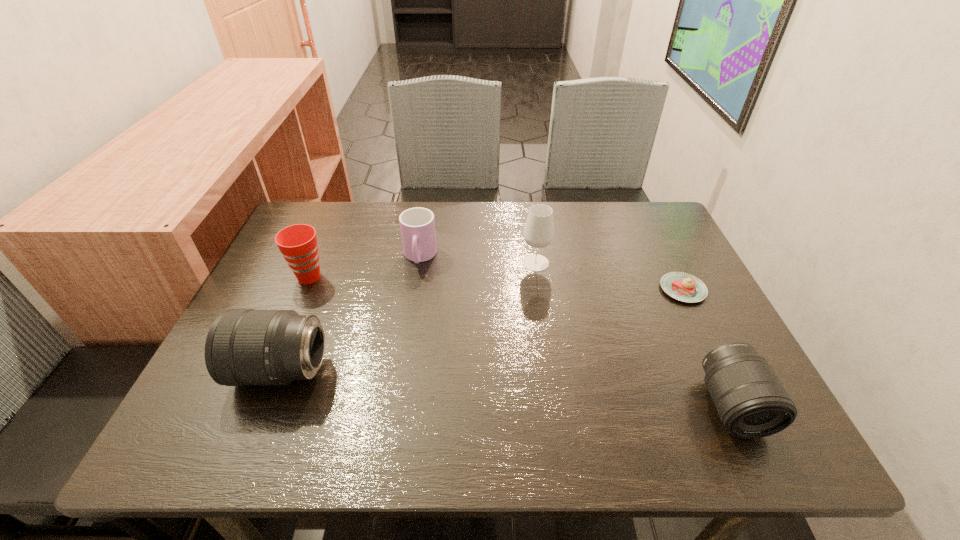
Where is `vacant space at the right edge of the desktop`? This screenshot has width=960, height=540. vacant space at the right edge of the desktop is located at coordinates (712, 324).

The image size is (960, 540). In order to click on vacant region between the third object from right to left and the shorter telephoto lens in this screenshot , I will do tap(634, 334).

Find the location of a particular element. This screenshot has height=540, width=960. free space between the taller telephoto lens and the right telephoto lens is located at coordinates (507, 388).

Identify the location of vacant point located between the glass and the right telephoto lens. This screenshot has height=540, width=960. (634, 334).

The image size is (960, 540). What are the coordinates of `unoccupied area between the fourth object from left to right and the fourth object from right to left` in the screenshot? It's located at (477, 260).

The image size is (960, 540). I want to click on empty location between the right telephoto lens and the left cup, so click(520, 341).

Locate an element on the screen. vacant space that's between the right cup and the left cup is located at coordinates (365, 267).

Where is `vacant space that is in between the fourth object from left to right and the left cup`? The image size is (960, 540). vacant space that is in between the fourth object from left to right and the left cup is located at coordinates (422, 270).

At what (x,y) coordinates should I click in order to perform the action: click on vacant space in between the shortest object and the glass. Please return your answer as a coordinate pair (x, y). Image resolution: width=960 pixels, height=540 pixels. Looking at the image, I should click on (610, 276).

Identify which object is the second closest to the left telephoto lens. Please provide its 2D coordinates. Your answer should be formatted as a tuple, i.e. [(x, y)], where the tuple contains the x and y coordinates of a point satisfying the conditions above.

[(417, 225)]